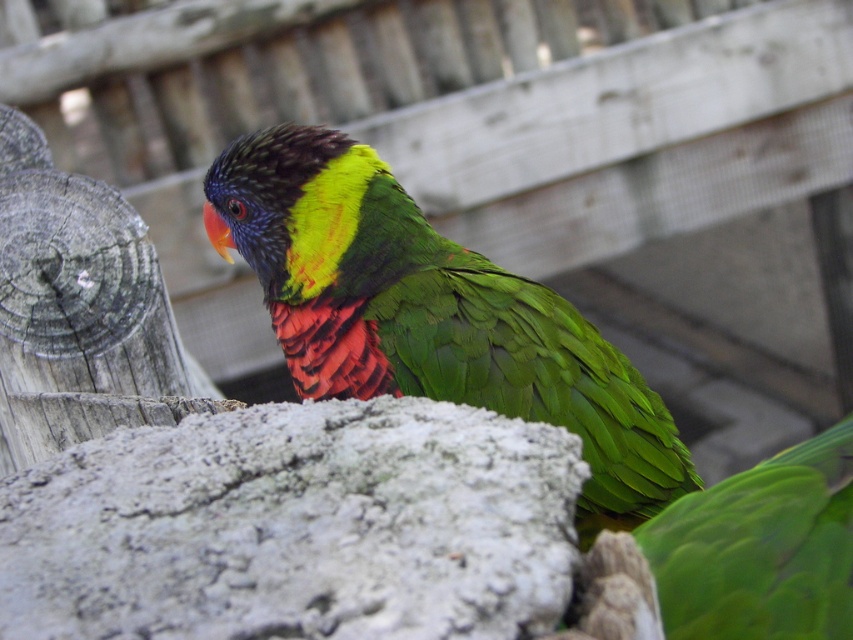
Question: Is shiny green parrot at center bigger than green matte parrot at center?

Choices:
 (A) no
 (B) yes

Answer: (B)

Question: Which point is farther from the camera taking this photo?

Choices:
 (A) (741, 604)
 (B) (483, 337)

Answer: (B)

Question: Where is shiny green parrot at center located in relation to green matte parrot at center in the image?

Choices:
 (A) above
 (B) below

Answer: (A)

Question: Which point is closer to the camera?

Choices:
 (A) (698, 522)
 (B) (247, 243)

Answer: (A)

Question: Is shiny green parrot at center positioned before green matte parrot at center?

Choices:
 (A) no
 (B) yes

Answer: (A)

Question: Which point is farther to the camera?

Choices:
 (A) (827, 556)
 (B) (287, 196)

Answer: (B)